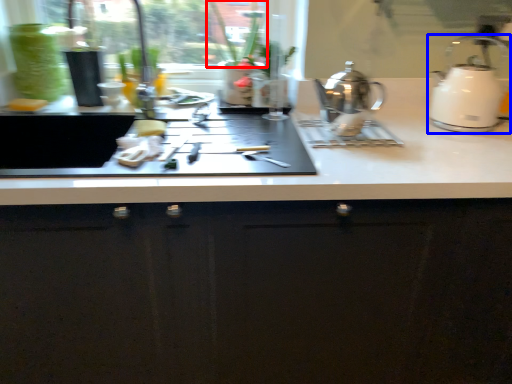
Question: Which object is further to the camera taking this photo, plant (highlighted by a red box) or kettle (highlighted by a blue box)?

Choices:
 (A) plant
 (B) kettle

Answer: (A)